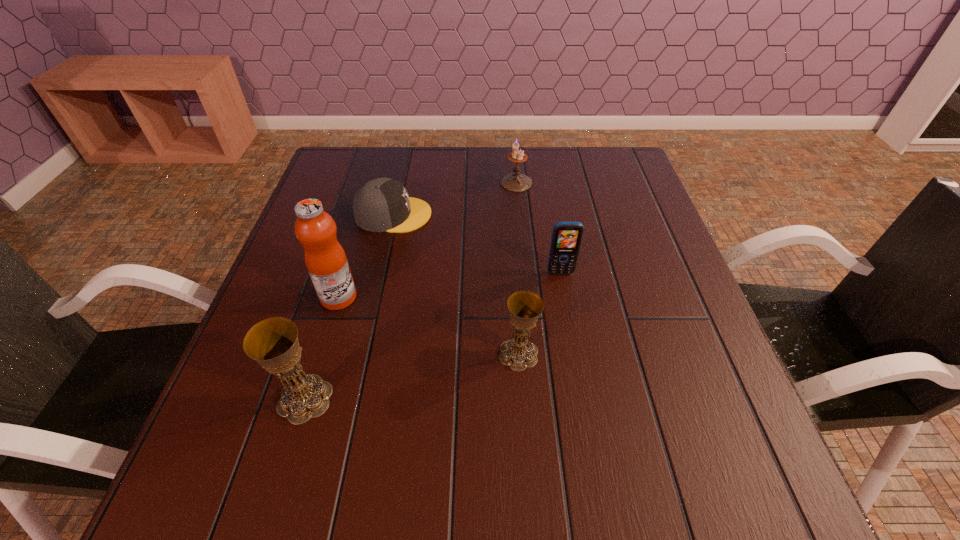
You are a GUI agent. You are given a task and a screenshot of the screen. Output one action in this format:
    pyautogui.click(x=<x>, y=<y>)
    Task: Click on the taller chalice
    
    Given the screenshot: What is the action you would take?
    pyautogui.click(x=273, y=343)

This screenshot has width=960, height=540. I want to click on the left chalice, so click(273, 343).

Image resolution: width=960 pixels, height=540 pixels. Find the location of `the shorter chalice`. the shorter chalice is located at coordinates click(525, 307).

You are a GUI agent. You are given a task and a screenshot of the screen. Output one action in this format:
    pyautogui.click(x=<x>, y=<y>)
    Task: Click on the farther chalice
    This screenshot has height=540, width=960.
    Given the screenshot: What is the action you would take?
    pyautogui.click(x=525, y=307)

The width and height of the screenshot is (960, 540). In order to click on candle holder in this screenshot , I will do `click(516, 182)`.

This screenshot has height=540, width=960. I want to click on the fifth nearest object, so click(381, 205).

Locate an element on the screen. The height and width of the screenshot is (540, 960). the shortest object is located at coordinates (381, 205).

Locate an element on the screen. The width and height of the screenshot is (960, 540). fruit juice is located at coordinates (326, 261).

Identify the location of the tallest object. (326, 261).

Find the location of a particular element. The height and width of the screenshot is (540, 960). the rightmost object is located at coordinates (566, 239).